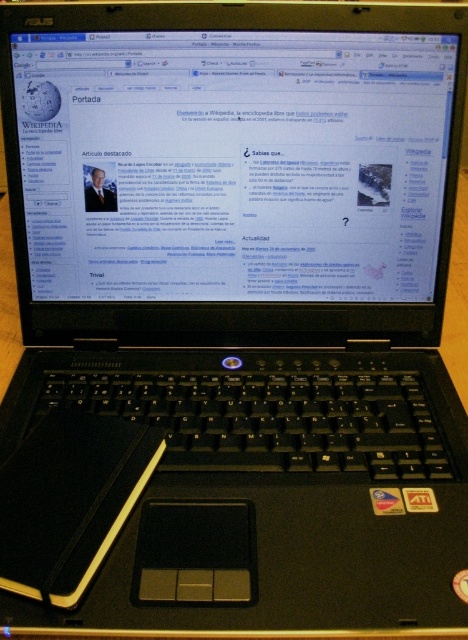
Question: Which point is closer to the camera taking this photo?

Choices:
 (A) (360, 196)
 (B) (51, 579)

Answer: (B)

Question: Is matte black screen at center wider than black leather notebook at lower left?

Choices:
 (A) no
 (B) yes

Answer: (B)

Question: Does matte black screen at center appear over black leather notebook at lower left?

Choices:
 (A) no
 (B) yes

Answer: (B)

Question: Does matte black screen at center have a smaller size compared to black leather notebook at lower left?

Choices:
 (A) yes
 (B) no

Answer: (B)

Question: Among these objects, which one is farthest from the camera?

Choices:
 (A) black leather notebook at lower left
 (B) matte black screen at center

Answer: (B)